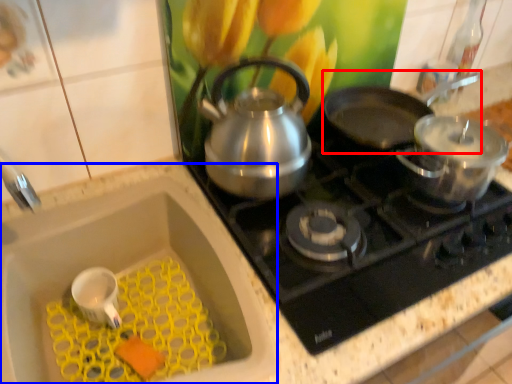
Question: Which point is closer to the camera, frying pan (highlighted by a red box) or sink (highlighted by a blue box)?

Choices:
 (A) frying pan
 (B) sink

Answer: (B)